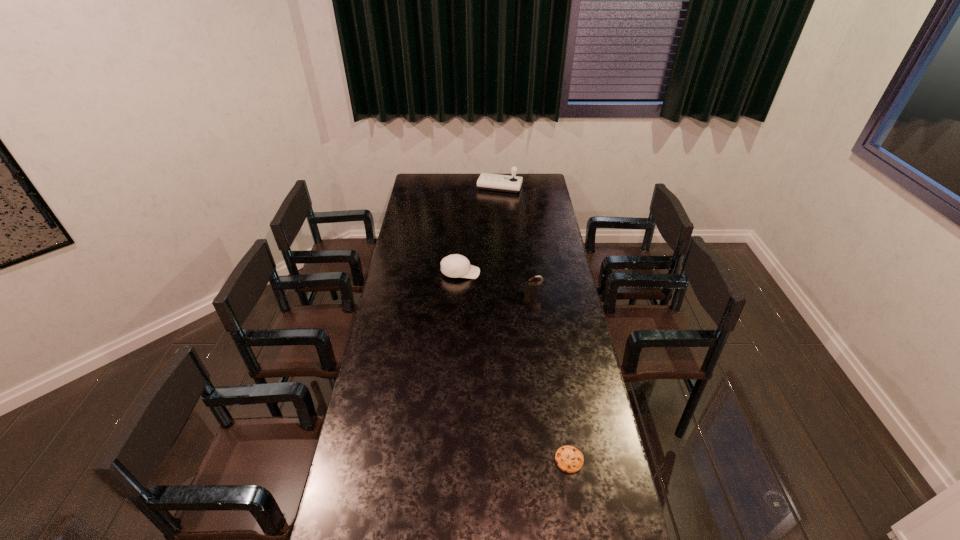
Identify the location of object located in the far edge section of the desktop. Image resolution: width=960 pixels, height=540 pixels. (495, 182).

You are a GUI agent. You are given a task and a screenshot of the screen. Output one action in this format:
    pyautogui.click(x=<x>, y=<y>)
    Task: Click on the padlock that is at the right edge
    This screenshot has height=540, width=960.
    Given the screenshot: What is the action you would take?
    pyautogui.click(x=530, y=288)

Image resolution: width=960 pixels, height=540 pixels. Find the location of `cookie that is at the right edge`. cookie that is at the right edge is located at coordinates (569, 459).

The image size is (960, 540). I want to click on free point at the far edge, so click(x=445, y=181).

Locate an element on the screen. The width and height of the screenshot is (960, 540). free space at the left edge is located at coordinates (397, 339).

Where is `vacant space at the right edge of the desktop`? The width and height of the screenshot is (960, 540). vacant space at the right edge of the desktop is located at coordinates (597, 489).

The width and height of the screenshot is (960, 540). What are the coordinates of `empty space that is in between the farthest object and the nearest object` in the screenshot? It's located at (535, 323).

Where is `empty space between the nearest object and the padlock`? This screenshot has height=540, width=960. empty space between the nearest object and the padlock is located at coordinates (551, 376).

You are a GUI agent. You are given a task and a screenshot of the screen. Output one action in this format:
    pyautogui.click(x=<x>, y=<y>)
    Task: Click on the free space between the second nearest object and the farthest object
    
    Given the screenshot: What is the action you would take?
    pyautogui.click(x=516, y=240)

The height and width of the screenshot is (540, 960). Find the location of `empty space between the farthest object and the nearest object`. empty space between the farthest object and the nearest object is located at coordinates (535, 323).